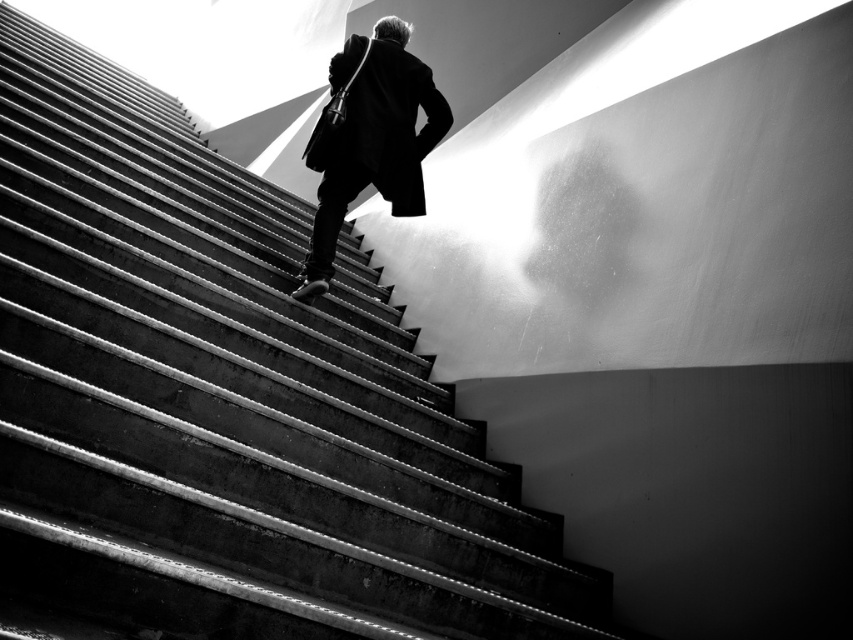
You are standing at the bottom of the concrete stairs at center and want to carry a large box that is wider than your black matte coat at center. Can you determine if the stairs will accommodate the box based on their width?

The concrete stairs at center are wider than the black matte coat at center, so if the box is wider than the coat, the stairs should still accommodate it as long as the box is not wider than the stairs.

From the picture: You are standing in front of the staircase and see the point marked at coordinates point (251, 632). If you want to place a small plant pot exactly at that point, will it be safe for people walking up the stairs?

The point (251, 632) is 1.50 meters from the viewer, so placing a small plant pot there would be safe as it is at a sufficient distance from the walking path.

You are standing in front of the staircase and want to determine which of the two points, point (283, 582) or point (321, 240), is nearer to you. Based on the scene, which point is closer?

Point (283, 582) is closer to the camera than point (321, 240), so it is the nearer one.